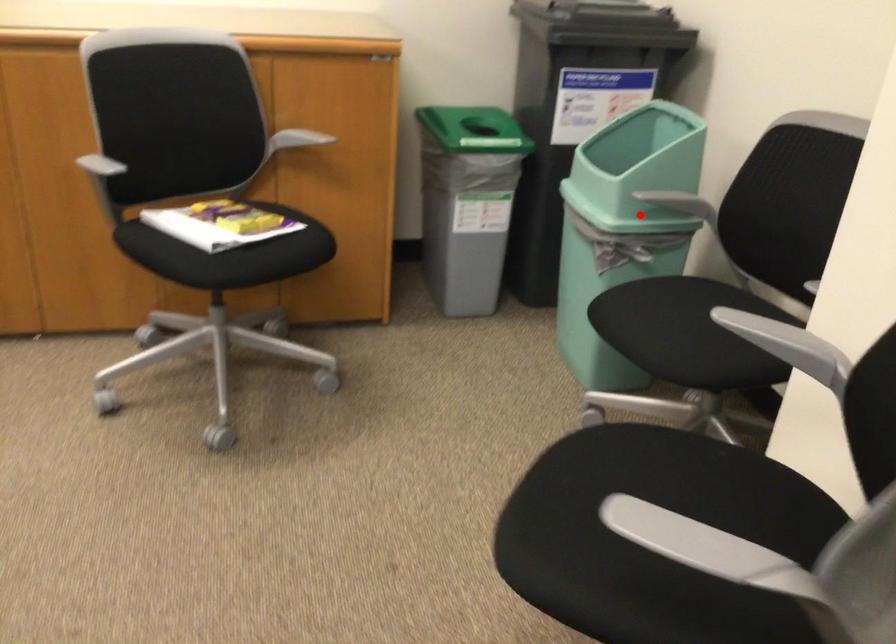
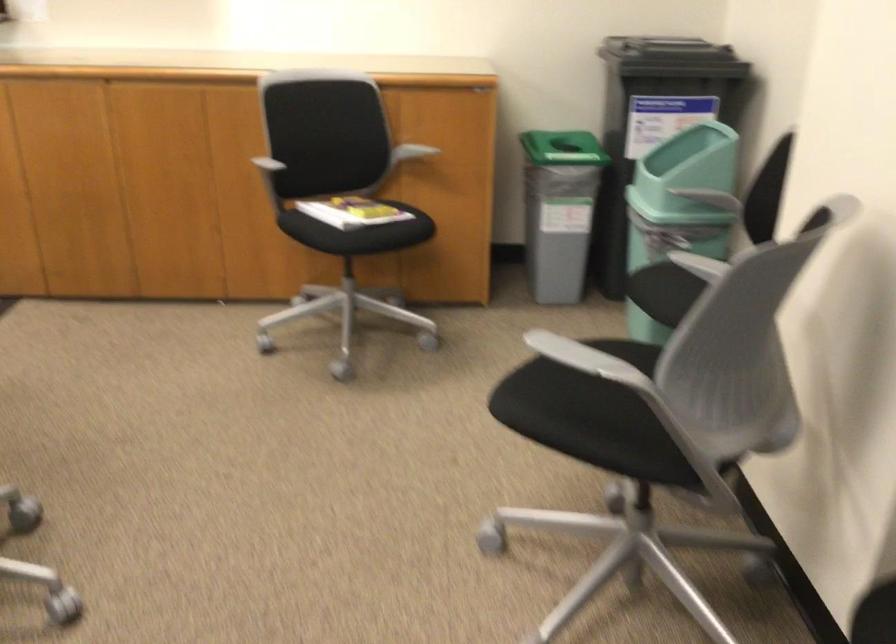
Question: I am providing you with two images of the same scene from different viewpoints. Image1 has a red point marked. In image2, the corresponding 3D location appears at what relative position? Reply with the corresponding letter.

Choices:
 (A) Closer
 (B) Farther

Answer: (B)